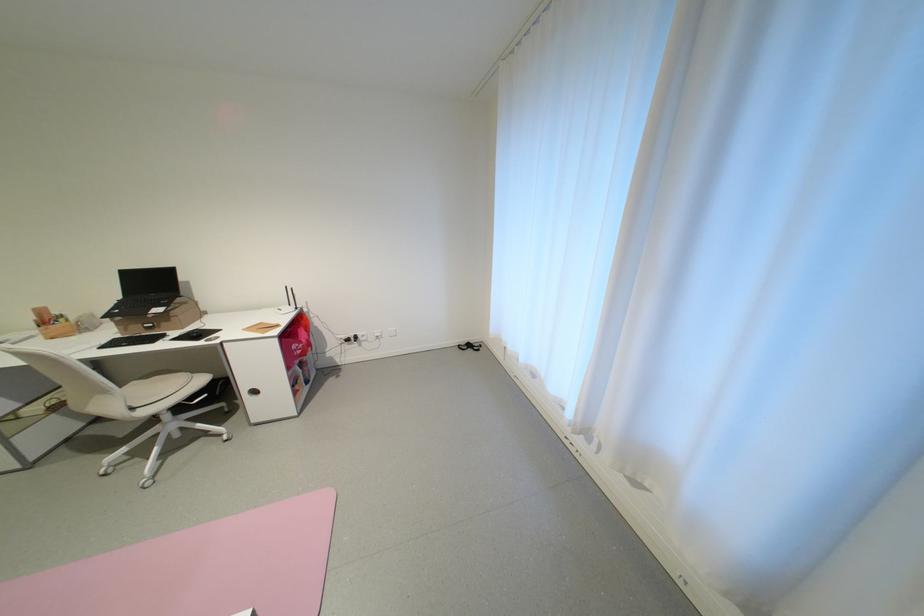
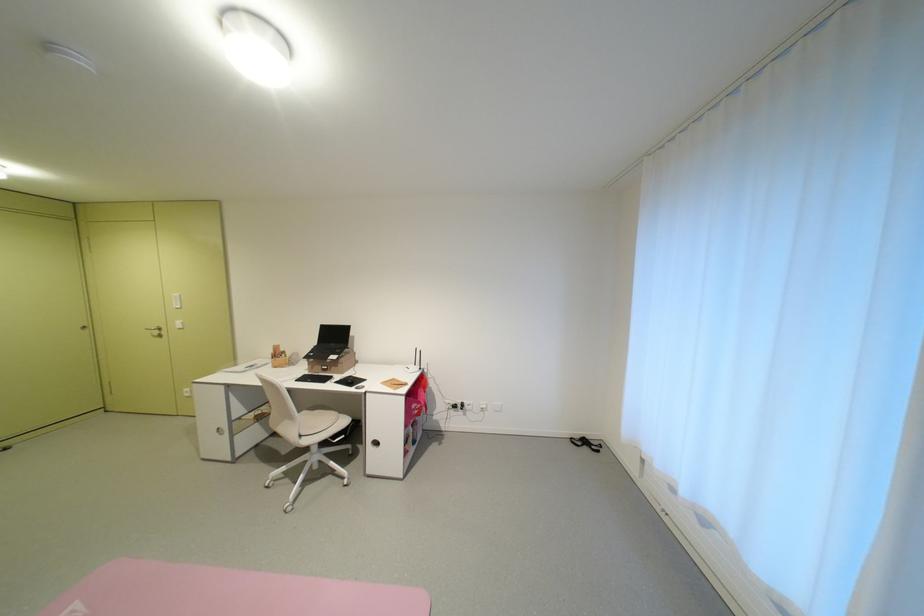
Find the pixel in the second image that matches the point at 178,322 in the first image.

(346, 368)